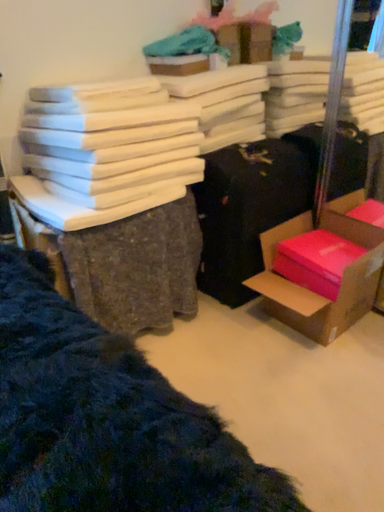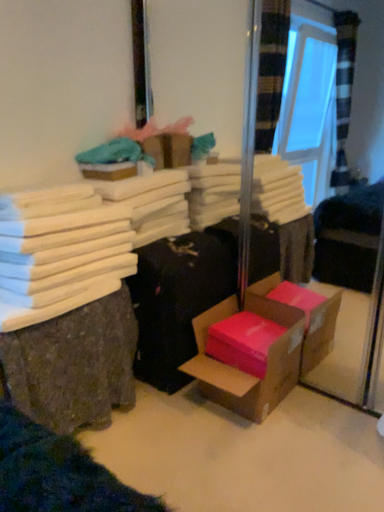
Question: How did the camera likely rotate when shooting the video?

Choices:
 (A) rotated upward
 (B) rotated downward

Answer: (A)